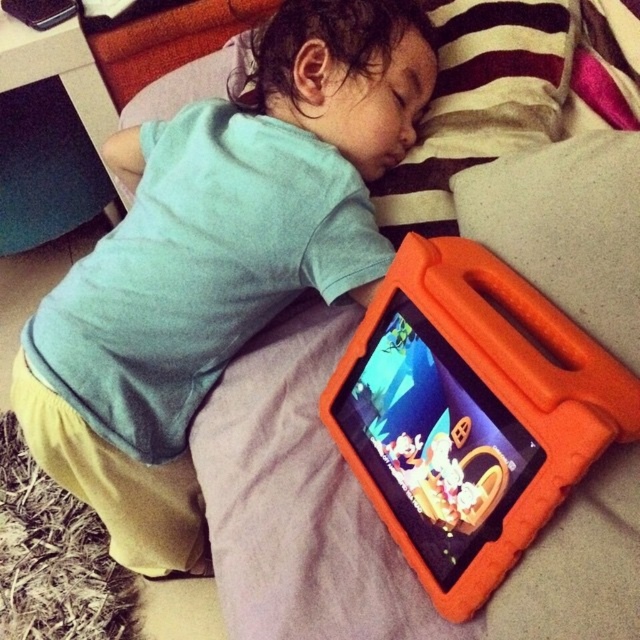
Who is more forward, (497,525) or (525,236)?

Point (497,525) is in front.

Is orange foam tablet at lower right above orange foam pillow at center?

Incorrect, orange foam tablet at lower right is not positioned above orange foam pillow at center.

I want to click on orange foam tablet at lower right, so click(470, 413).

At what (x,y) coordinates should I click in order to perform the action: click on matte orange tablet at lower right. Please return your answer as a coordinate pair (x, y). This screenshot has width=640, height=640. Looking at the image, I should click on (216, 260).

Which is behind, point (291, 22) or point (545, 160)?

The point (291, 22) is more distant.

Does point (88, 342) lie in front of point (566, 209)?

No.

The height and width of the screenshot is (640, 640). I want to click on matte orange tablet at lower right, so pyautogui.click(x=216, y=260).

Which of these two, matte orange tablet at lower right or orange foam tablet at lower right, stands shorter?

Standing shorter between the two is orange foam tablet at lower right.

Between point (72, 291) and point (493, 321), which one is positioned behind?

Point (72, 291)

Is point (372, 266) positioned behind point (470, 435)?

Yes, point (372, 266) is behind point (470, 435).

At what (x,y) coordinates should I click in order to perform the action: click on matte orange tablet at lower right. Please return your answer as a coordinate pair (x, y). The height and width of the screenshot is (640, 640). Looking at the image, I should click on (216, 260).